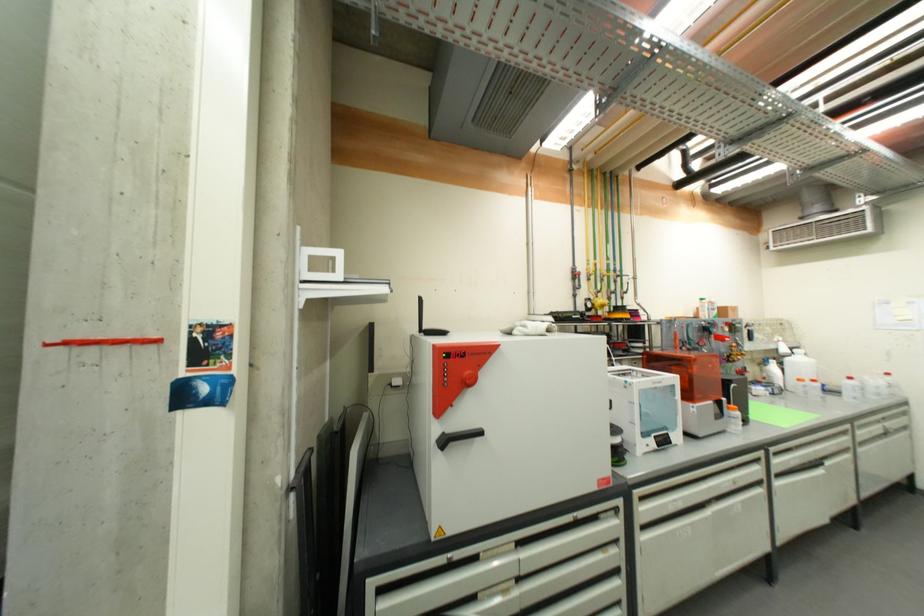
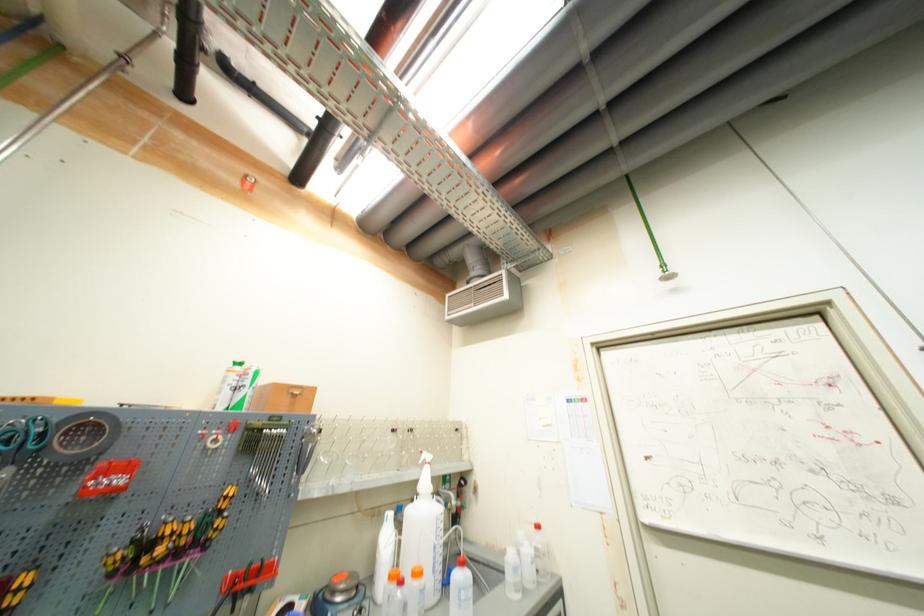
The point at (782, 351) is marked in the first image. Where is the corresponding point in the second image?

(421, 484)